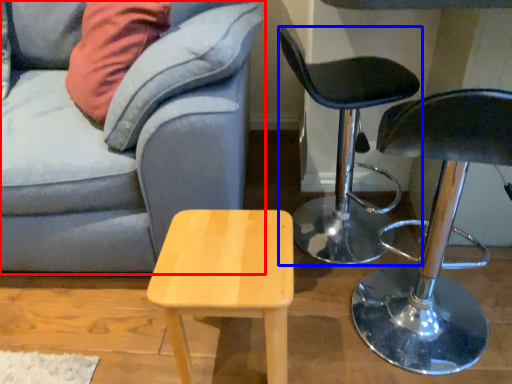
Question: Which of the following is the farthest to the observer, studio couch (highlighted by a red box) or chair (highlighted by a blue box)?

Choices:
 (A) studio couch
 (B) chair

Answer: (B)